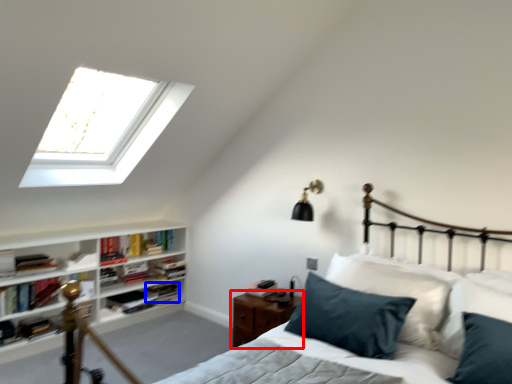
Question: Which object is further to the camera taking this photo, nightstand (highlighted by a red box) or book (highlighted by a blue box)?

Choices:
 (A) nightstand
 (B) book

Answer: (B)